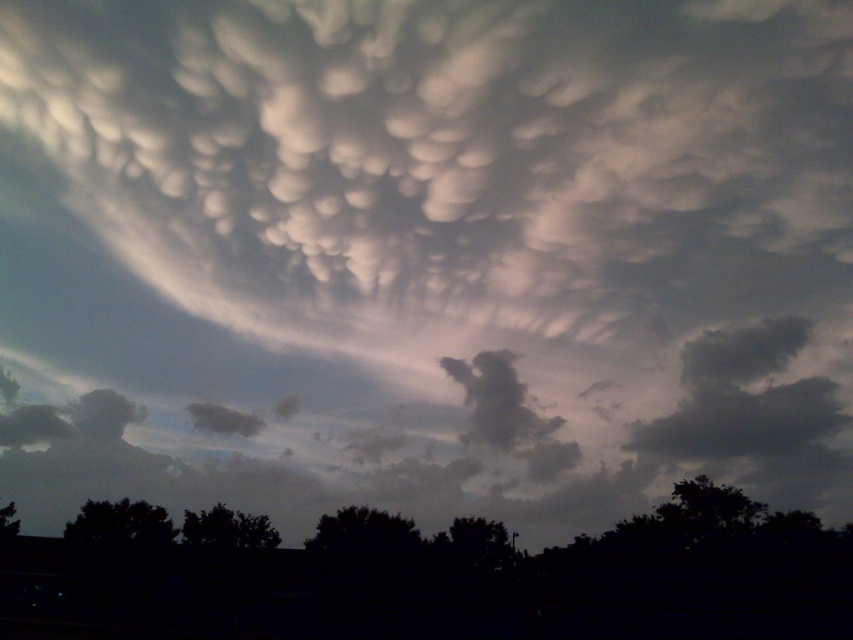
You are an observer looking at the sky scene. You notice two trees in the foreground, the dark green leafy tree at center and the green leafy tree at lower center. From your perspective, which tree is positioned more to the right?

The dark green leafy tree at center is positioned more to the right compared to the green leafy tree at lower center.

You are standing in a field and see the dark green leafy tree at center and the green leafy tree at lower center. Which tree is closer to you?

The green leafy tree at lower center is closer to you because it is positioned below the dark green leafy tree at center, which is above it.

You are an observer looking at the sky scene. You notice two trees in the foreground. Which tree, the dark green leafy tree at lower right or the green leafy tree at lower left, appears bigger in the image?

The dark green leafy tree at lower right appears bigger in the image as it has a larger size compared to the green leafy tree at lower left.